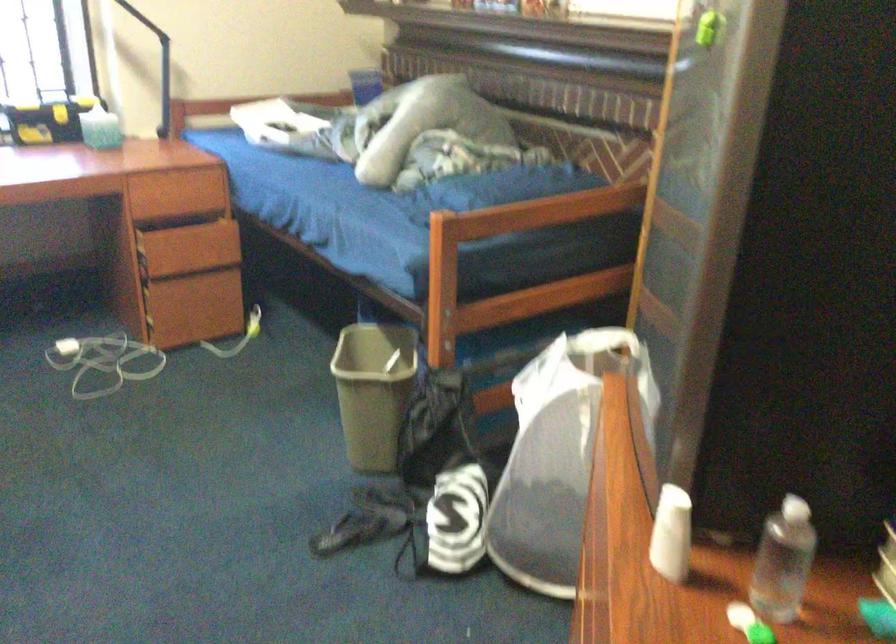
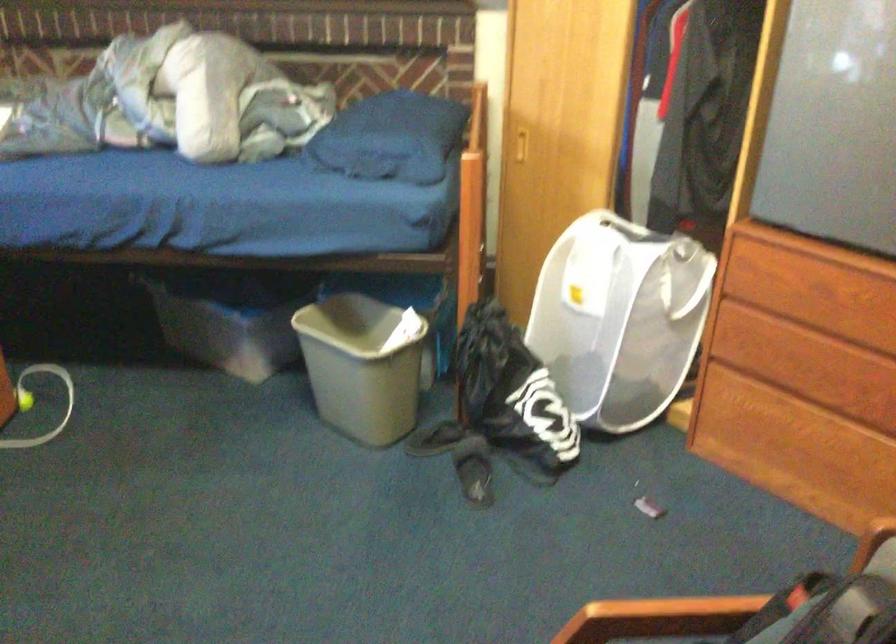
The point at [461,474] is marked in the first image. Where is the corresponding point in the second image?

(513, 395)